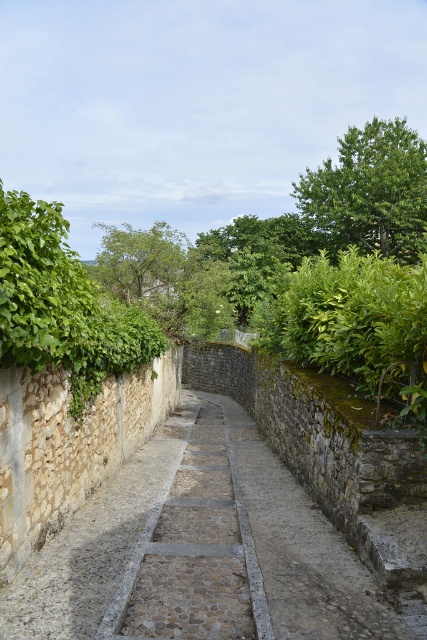
Question: Considering the real-world distances, which object is farthest from the green leafy tree at upper right?

Choices:
 (A) stone paved path at center
 (B) green leafy tree at center

Answer: (A)

Question: Is green leafy tree at upper right further to the viewer compared to green leafy tree at center?

Choices:
 (A) yes
 (B) no

Answer: (A)

Question: Which point appears farthest from the camera in this image?

Choices:
 (A) (155, 272)
 (B) (113, 637)
 (C) (418, 244)

Answer: (C)

Question: Which object appears farthest from the camera in this image?

Choices:
 (A) green leafy tree at center
 (B) stone paved path at center
 (C) green leafy tree at upper right

Answer: (C)

Question: Can you confirm if stone paved path at center is positioned to the left of green leafy tree at upper right?

Choices:
 (A) yes
 (B) no

Answer: (A)

Question: Is green leafy tree at upper right above green leafy tree at center?

Choices:
 (A) no
 (B) yes

Answer: (B)